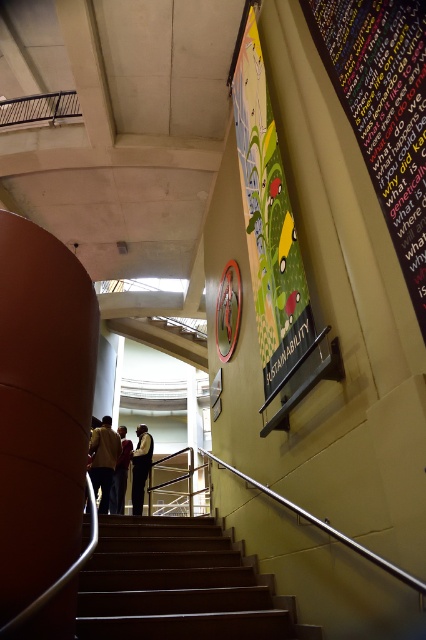
Question: Which point appears closest to the camera in this image?

Choices:
 (A) (198, 545)
 (B) (279, 276)

Answer: (B)

Question: Which of the following is the farthest from the observer?

Choices:
 (A) (135, 497)
 (B) (216, 536)
 (C) (408, 168)

Answer: (A)

Question: Considering the relative positions of vibrant glossy poster at upper center and dark brown leather jacket at center in the image provided, where is vibrant glossy poster at upper center located with respect to dark brown leather jacket at center?

Choices:
 (A) above
 (B) below

Answer: (A)

Question: Which of the following is the farthest from the observer?

Choices:
 (A) vibrant glossy poster at upper center
 (B) dark blue shirt at center
 (C) yellow fabric jacket at center

Answer: (B)

Question: From the image, what is the correct spatial relationship of wooden stairs at center in relation to multicolored fabric bulletin board at upper right?

Choices:
 (A) left
 (B) right

Answer: (A)

Question: Can you confirm if wooden stairs at center is wider than multicolored fabric bulletin board at upper right?

Choices:
 (A) no
 (B) yes

Answer: (B)